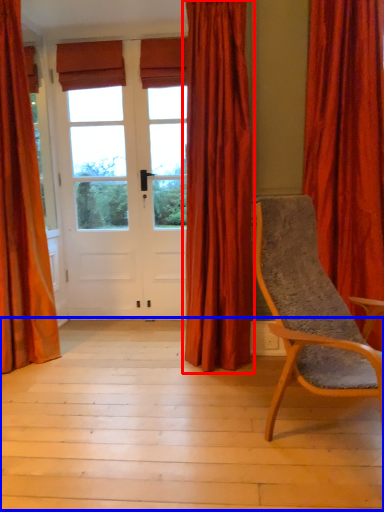
Question: Which object appears closest to the camera in this image, curtain (highlighted by a red box) or porch (highlighted by a blue box)?

Choices:
 (A) curtain
 (B) porch

Answer: (B)